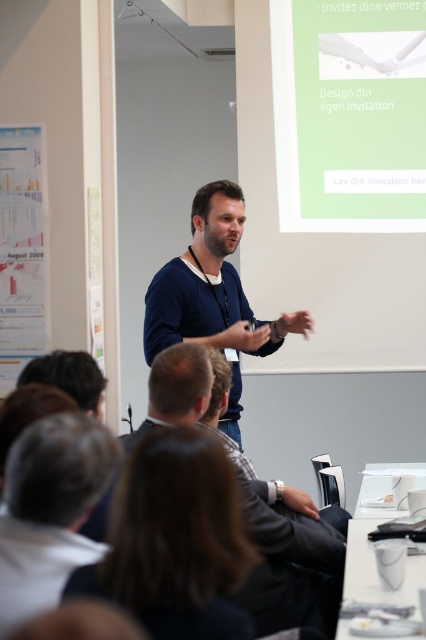
Does white fabric shirt at lower left have a greater width compared to dark blue sweater at center?

Incorrect, white fabric shirt at lower left's width does not surpass dark blue sweater at center's.

Does white fabric shirt at lower left appear under dark blue sweater at center?

Yes, white fabric shirt at lower left is below dark blue sweater at center.

I want to click on white fabric shirt at lower left, so click(49, 509).

This screenshot has height=640, width=426. I want to click on white fabric shirt at lower left, so click(x=49, y=509).

Does dark brown hair at upper center have a lesser height compared to dark blue sweater at center?

Yes.

Is point (124, 499) positioned after point (180, 291)?

That is False.

The image size is (426, 640). Find the location of `dark brown hair at upper center`. dark brown hair at upper center is located at coordinates (175, 540).

Between green matte projection screen at upper center and dark blue sweater at center, which one appears on the right side from the viewer's perspective?

green matte projection screen at upper center is more to the right.

Locate an element on the screen. The width and height of the screenshot is (426, 640). green matte projection screen at upper center is located at coordinates (348, 113).